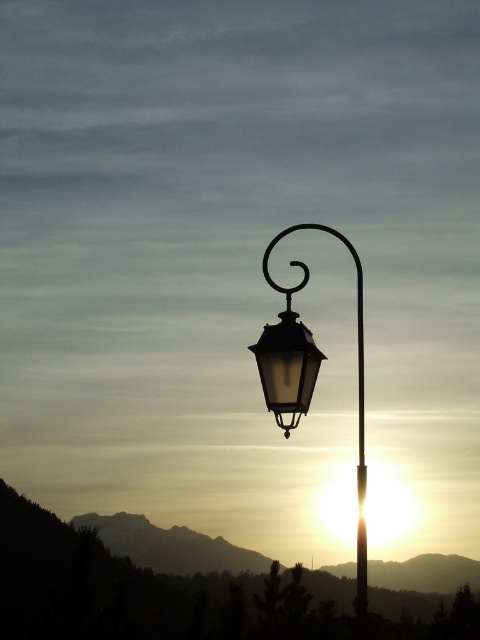
Which is behind, point (265, 394) or point (362, 348)?

The point (362, 348) is more distant.

Who is more distant from viewer, (265, 394) or (356, 257)?

The point (356, 257) is behind.

Identify the location of matte black lantern at center. (287, 368).

Does matte glass street light at center lie in front of matte black lantern at center?

Yes, it is.

Does matte glass street light at center appear on the left side of matte black lantern at center?

Incorrect, matte glass street light at center is not on the left side of matte black lantern at center.

Is point (361, 360) behind point (275, 406)?

Yes, it is behind point (275, 406).

Find the location of a particular element. matte glass street light at center is located at coordinates (314, 380).

Which is more to the right, matte glass street light at center or metallic pole at center?

Positioned to the right is metallic pole at center.

Based on the photo, which of these two, matte glass street light at center or metallic pole at center, stands taller?

matte glass street light at center

The width and height of the screenshot is (480, 640). What are the coordinates of `matte glass street light at center` in the screenshot? It's located at (314, 380).